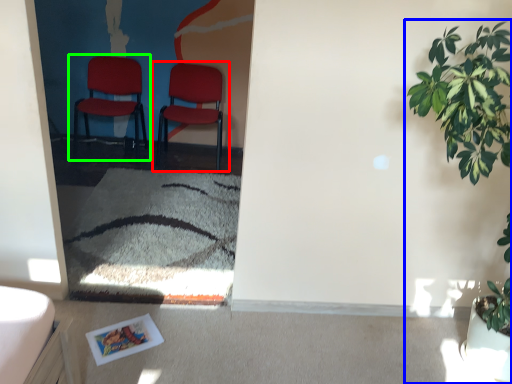
Question: Which is farther away from chair (highlighted by a red box)? houseplant (highlighted by a blue box) or chair (highlighted by a green box)?

Choices:
 (A) houseplant
 (B) chair

Answer: (A)